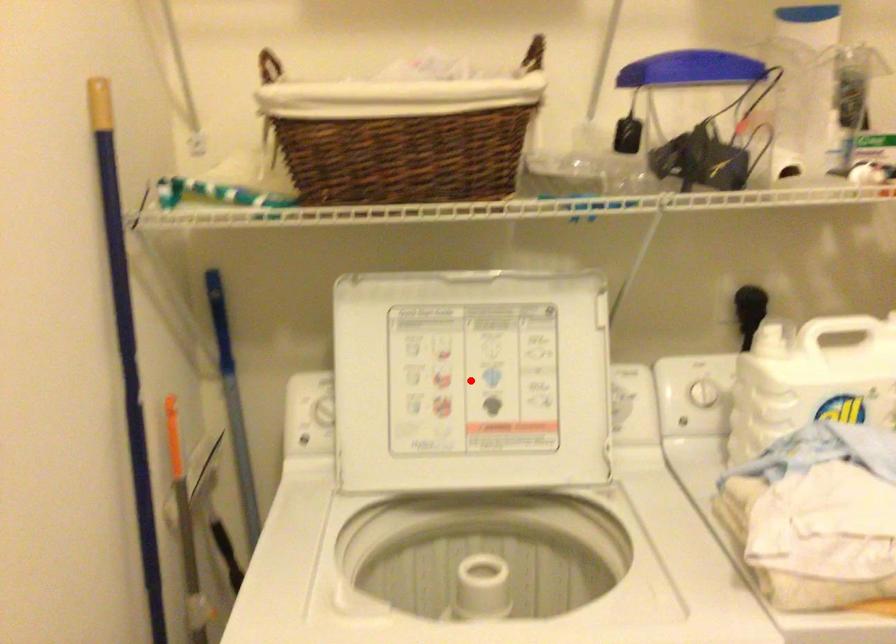
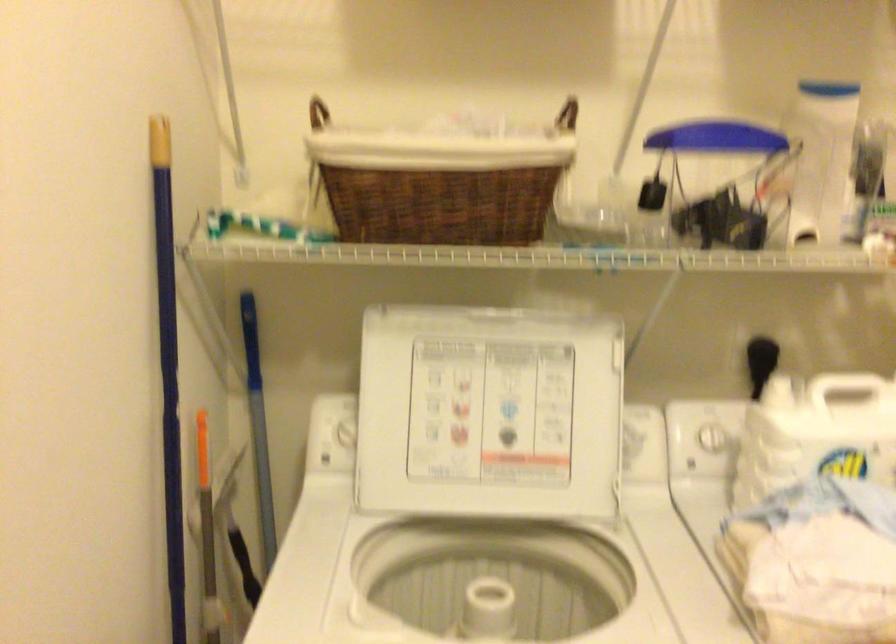
In the second image, find the point that corresponds to the highlighted location in the first image.

(488, 413)